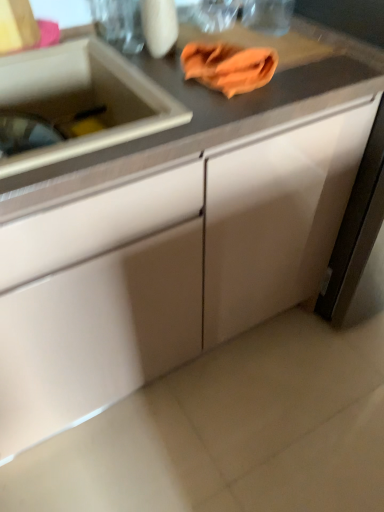
Question: Would you say matte white cabinet at center, the first cabinetry positioned from the left, is part of white matte cabinet at right, the first cabinetry when ordered from right to left,'s contents?

Choices:
 (A) no
 (B) yes

Answer: (A)

Question: From a real-world perspective, is white matte cabinet at right, which is counted as the 2th cabinetry, starting from the left, physically below matte white cabinet at center, positioned as the second cabinetry in right-to-left order?

Choices:
 (A) yes
 (B) no

Answer: (B)

Question: Is white matte cabinet at right, which is counted as the 2th cabinetry, starting from the left, oriented towards matte white cabinet at center, the first cabinetry positioned from the left?

Choices:
 (A) yes
 (B) no

Answer: (B)

Question: Can you confirm if white matte cabinet at right, the first cabinetry when ordered from right to left, is bigger than matte white cabinet at center, positioned as the second cabinetry in right-to-left order?

Choices:
 (A) yes
 (B) no

Answer: (B)

Question: Is white matte cabinet at right, the first cabinetry when ordered from right to left, taller than matte white cabinet at center, positioned as the second cabinetry in right-to-left order?

Choices:
 (A) no
 (B) yes

Answer: (B)

Question: From the image's perspective, is matte white cabinet at center, positioned as the second cabinetry in right-to-left order, positioned above or below orange cloth at upper center?

Choices:
 (A) below
 (B) above

Answer: (A)

Question: From a real-world perspective, is matte white cabinet at center, the first cabinetry positioned from the left, positioned above or below orange cloth at upper center?

Choices:
 (A) above
 (B) below

Answer: (B)

Question: In the image, is matte white cabinet at center, positioned as the second cabinetry in right-to-left order, positioned in front of or behind orange cloth at upper center?

Choices:
 (A) behind
 (B) front

Answer: (B)

Question: Would you say matte white cabinet at center, the first cabinetry positioned from the left, is inside or outside orange cloth at upper center?

Choices:
 (A) inside
 (B) outside

Answer: (B)

Question: Considering the positions of white glossy sink at left and white matte cabinet at right, which is counted as the 2th cabinetry, starting from the left, in the image, is white glossy sink at left bigger or smaller than white matte cabinet at right, which is counted as the 2th cabinetry, starting from the left,?

Choices:
 (A) small
 (B) big

Answer: (A)

Question: Considering the positions of point (67, 87) and point (334, 211), is point (67, 87) closer or farther from the camera than point (334, 211)?

Choices:
 (A) closer
 (B) farther

Answer: (A)

Question: Is white glossy sink at left situated inside white matte cabinet at right, the first cabinetry when ordered from right to left, or outside?

Choices:
 (A) outside
 (B) inside

Answer: (A)

Question: In the image, is white glossy sink at left on the left side or the right side of white matte cabinet at right, the first cabinetry when ordered from right to left?

Choices:
 (A) left
 (B) right

Answer: (A)

Question: Looking at the image, does white matte cabinet at right, which is counted as the 2th cabinetry, starting from the left, seem bigger or smaller compared to white glossy sink at left?

Choices:
 (A) big
 (B) small

Answer: (A)

Question: In terms of height, does white matte cabinet at right, which is counted as the 2th cabinetry, starting from the left, look taller or shorter compared to white glossy sink at left?

Choices:
 (A) short
 (B) tall

Answer: (B)